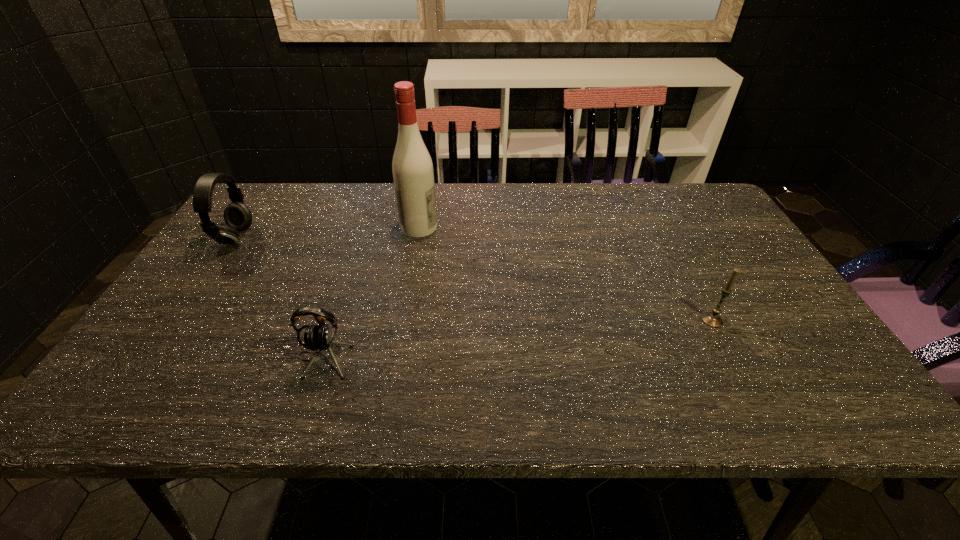
I want to click on free space at the right edge of the desktop, so click(729, 238).

I want to click on vacant space at the far left corner of the desktop, so click(x=267, y=200).

Locate an element on the screen. vacant area at the near left corner is located at coordinates (104, 407).

Locate an element on the screen. Image resolution: width=960 pixels, height=540 pixels. blank space at the far right corner of the desktop is located at coordinates (671, 183).

Where is `free space between the leftmost object and the shorter earphone`? Image resolution: width=960 pixels, height=540 pixels. free space between the leftmost object and the shorter earphone is located at coordinates (279, 298).

You are a GUI agent. You are given a task and a screenshot of the screen. Output one action in this format:
    pyautogui.click(x=<x>, y=<y>)
    Task: Click on the free point between the right earphone and the second nearest object
    The height and width of the screenshot is (540, 960).
    Given the screenshot: What is the action you would take?
    pyautogui.click(x=517, y=339)

I want to click on free spot between the alcohol and the nearest object, so click(372, 292).

Locate an element on the screen. The height and width of the screenshot is (540, 960). free area in between the second tallest object and the shorter earphone is located at coordinates 279,298.

Identify the location of free area in between the candle and the taller earphone. (474, 279).

Find the location of `vacant area that lies between the alcohol and the farther earphone`. vacant area that lies between the alcohol and the farther earphone is located at coordinates (327, 233).